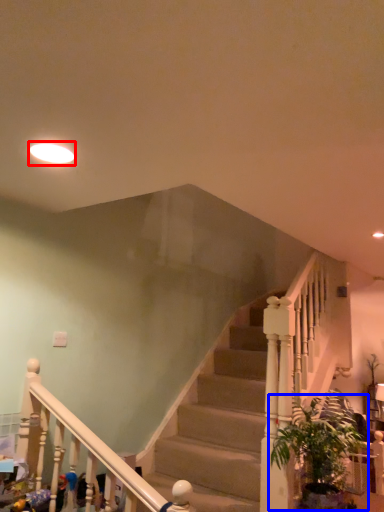
Question: Which point is further to the camera, lighting (highlighted by a red box) or houseplant (highlighted by a blue box)?

Choices:
 (A) lighting
 (B) houseplant

Answer: (B)